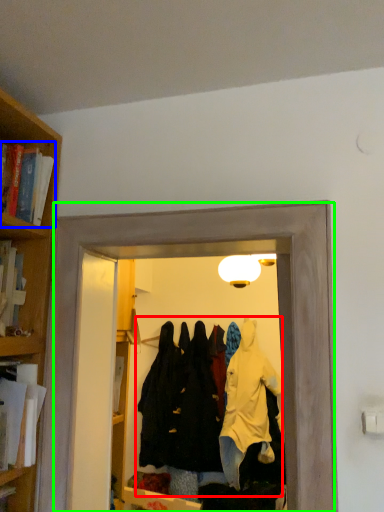
Question: Based on their relative distances, which object is farther from clothing (highlighted by a red box)? Choose from book (highlighted by a blue box) and glass door (highlighted by a green box).

Choices:
 (A) book
 (B) glass door

Answer: (A)